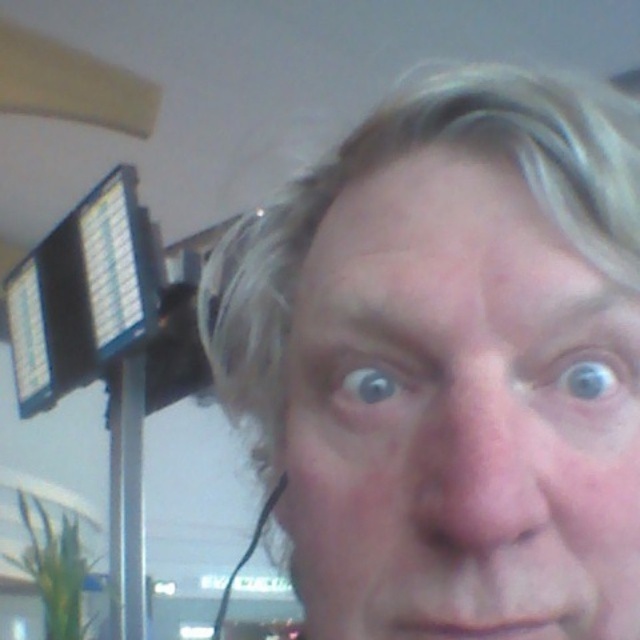
You are a photographer adjusting your camera settings to focus on a specific point in the image. You want to ensure that the point at coordinates point (552, 172) is in sharp focus. Given that your camera has a depth of field that can clearly capture objects within 25 centimeters from the current focal point, should you adjust your focus closer or farther away from the current position?

The distance of point (552, 172) from viewer is 25.54 centimeters. Since the depth of field can capture up to 25 centimeters, you need to adjust your focus closer by 0.54 centimeters to ensure the point is within the clear range.

You are a photographer adjusting your camera settings to capture the scene. You notice the gray matte hair at center and the black glossy monitor at upper left. Which object should you focus on if you want to ensure the smaller one is in sharp detail?

The gray matte hair at center is smaller than the black glossy monitor at upper left, so you should focus on the gray matte hair at center to ensure it is in sharp detail.

You are a photographer adjusting your camera settings to capture the best shot of the scene. Considering the gray matte hair at center and the black glossy monitor at upper left, which object is shorter in height?

The gray matte hair at center has a lesser height compared to the black glossy monitor at upper left, so the gray matte hair at center is shorter in height.